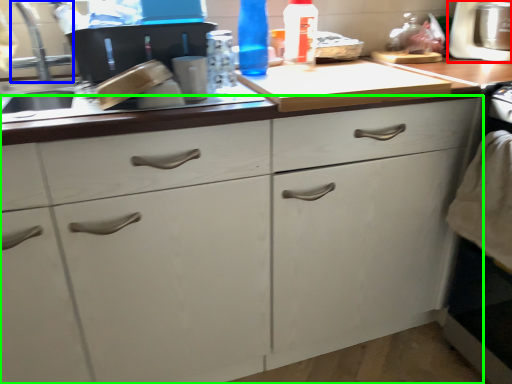
Question: Estimate the real-world distances between objects in this image. Which object is closer to appliance (highlighted by a red box), faucet (highlighted by a blue box) or cabinetry (highlighted by a green box)?

Choices:
 (A) faucet
 (B) cabinetry

Answer: (B)